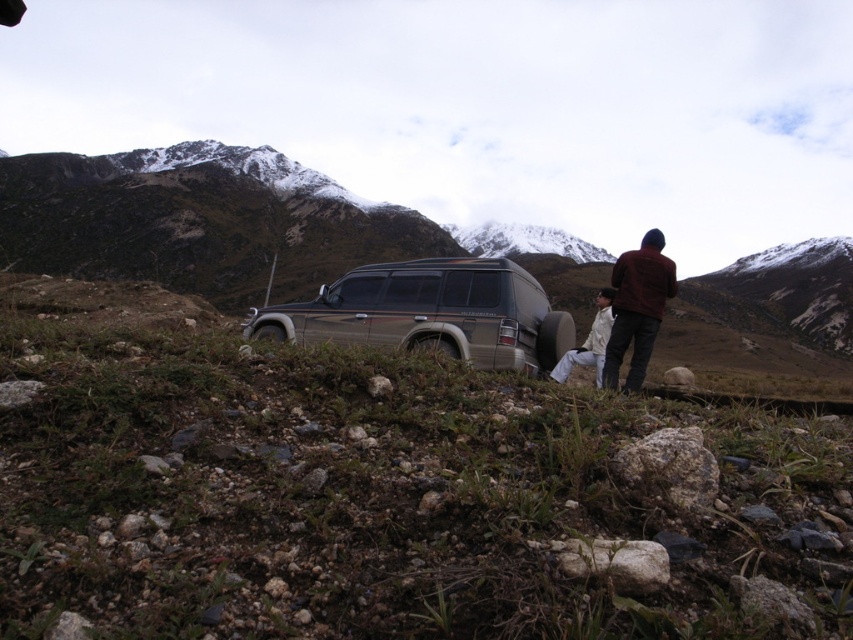
Does satin gold suv at center appear under snowy granite mountain at upper center?

Yes, satin gold suv at center is below snowy granite mountain at upper center.

Which is more to the left, satin gold suv at center or snowy granite mountain at upper center?

From the viewer's perspective, satin gold suv at center appears more on the left side.

What do you see at coordinates (428, 314) in the screenshot?
I see `satin gold suv at center` at bounding box center [428, 314].

Where is `satin gold suv at center`? The image size is (853, 640). satin gold suv at center is located at coordinates (428, 314).

Can you confirm if dark red sweater at right is shorter than white matte pants at center?

In fact, dark red sweater at right may be taller than white matte pants at center.

Is dark red sweater at right positioned before white matte pants at center?

Yes, it is.

What do you see at coordinates (637, 307) in the screenshot? Image resolution: width=853 pixels, height=640 pixels. I see `dark red sweater at right` at bounding box center [637, 307].

The image size is (853, 640). Find the location of `dark red sweater at right`. dark red sweater at right is located at coordinates (637, 307).

Where is `satin gold suv at center`? Image resolution: width=853 pixels, height=640 pixels. satin gold suv at center is located at coordinates tap(428, 314).

Is satin gold suv at center smaller than white matte pants at center?

No.

Where is `satin gold suv at center`? Image resolution: width=853 pixels, height=640 pixels. satin gold suv at center is located at coordinates (428, 314).

Find the location of a particular element. The width and height of the screenshot is (853, 640). satin gold suv at center is located at coordinates (x=428, y=314).